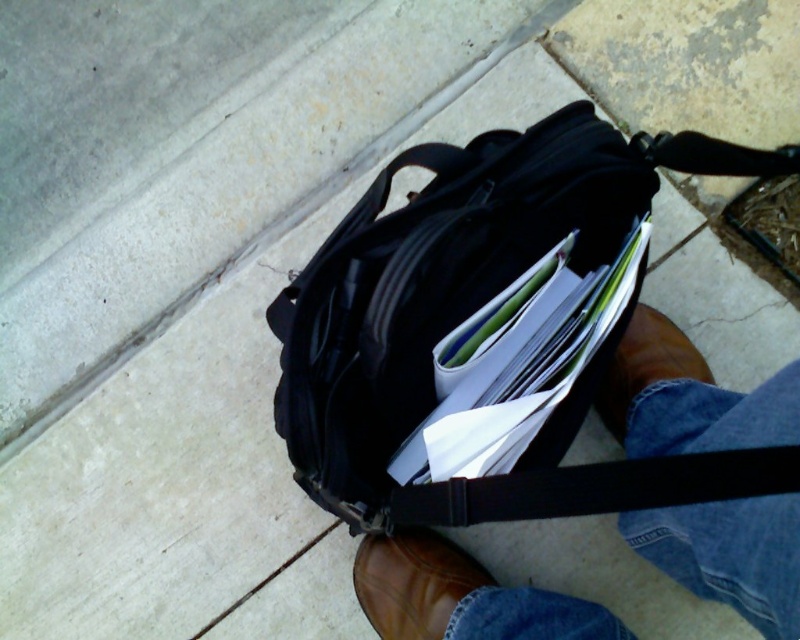
Question: Among these objects, which one is nearest to the camera?

Choices:
 (A) brown leather shoe at lower center
 (B) black matte bag at center
 (C) brown leather boot at lower center

Answer: (B)

Question: Among these objects, which one is farthest from the camera?

Choices:
 (A) brown leather boot at lower center
 (B) brown leather boots at lower center
 (C) brown leather shoe at lower center
 (D) black matte bag at center

Answer: (C)

Question: In this image, where is black matte bag at center located relative to brown leather boot at lower center?

Choices:
 (A) left
 (B) right

Answer: (A)

Question: Does brown leather shoe at lower center have a lesser width compared to brown leather boot at lower center?

Choices:
 (A) no
 (B) yes

Answer: (A)

Question: Is brown leather boots at lower center positioned before brown leather shoe at lower center?

Choices:
 (A) yes
 (B) no

Answer: (A)

Question: Which object is farther from the camera taking this photo?

Choices:
 (A) brown leather shoe at lower center
 (B) brown leather boot at lower center

Answer: (A)